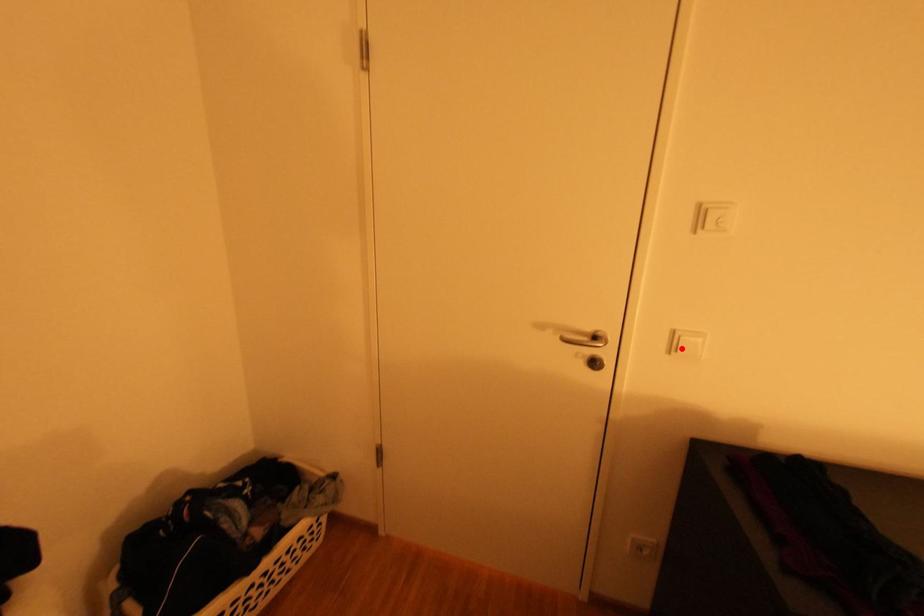
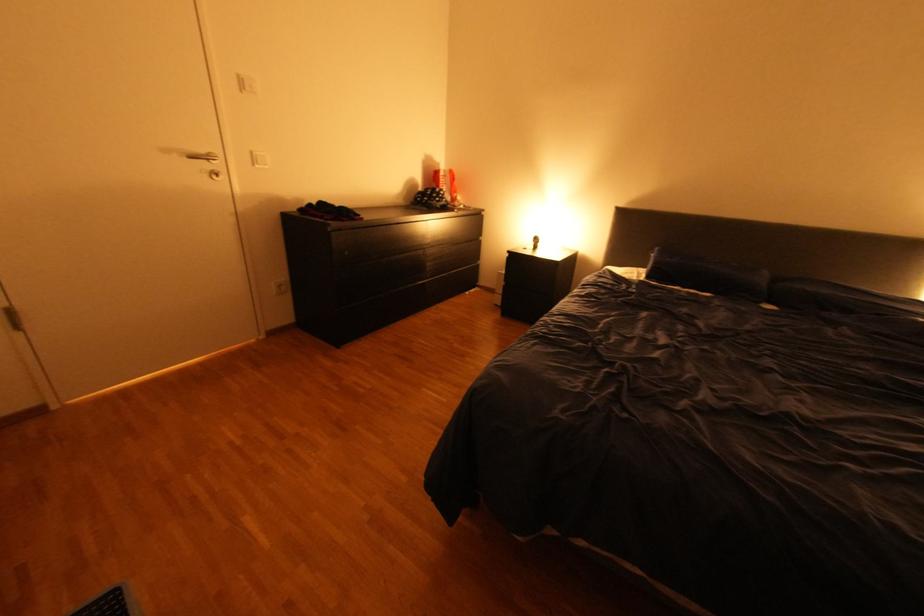
Find the pixel in the second image that matches the highlighted location in the first image.

(264, 161)